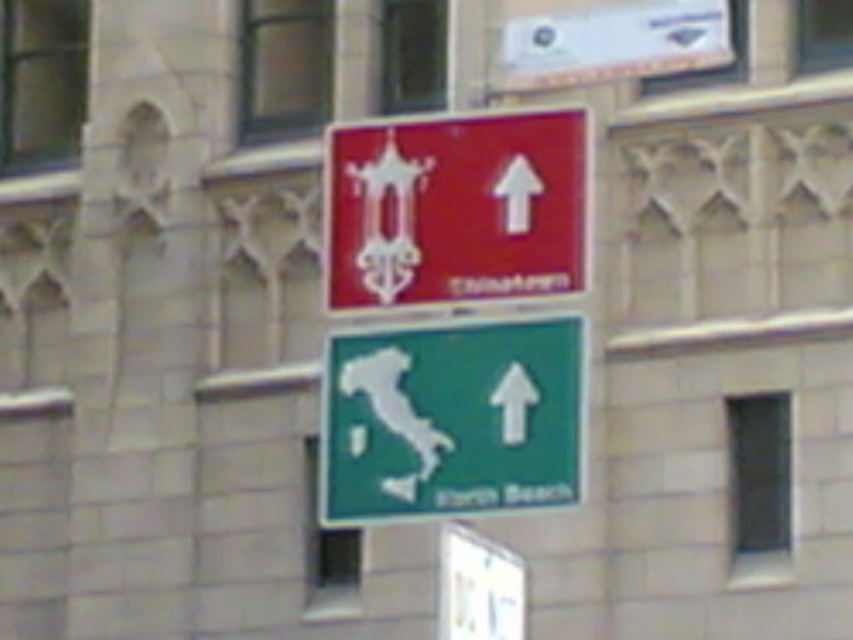
Question: Does green matte map at center have a lesser width compared to matte red sign at center?

Choices:
 (A) no
 (B) yes

Answer: (B)

Question: Does green matte map at center appear on the right side of matte red sign at center?

Choices:
 (A) no
 (B) yes

Answer: (A)

Question: Can you confirm if green matte map at center is bigger than matte red sign at center?

Choices:
 (A) no
 (B) yes

Answer: (A)

Question: Among these objects, which one is farthest from the camera?

Choices:
 (A) matte red sign at center
 (B) green matte map at center

Answer: (A)

Question: Which object appears farthest from the camera in this image?

Choices:
 (A) matte red sign at center
 (B) green matte map at center

Answer: (A)